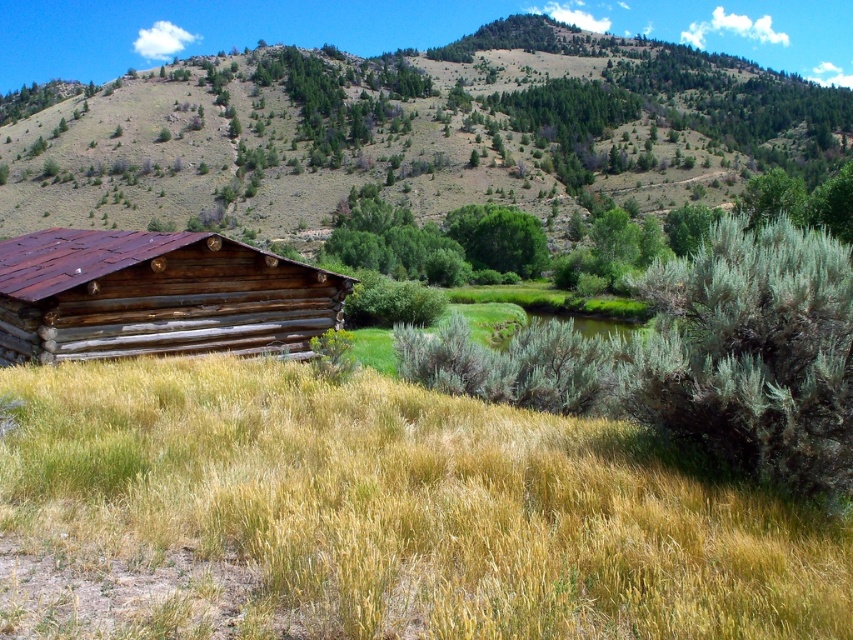
You are a hiker who wants to cross the stream but needs to find the shortest path. You see dry grass at lower left and green grassy hillside at upper center. Which area should you avoid to prevent getting your shoes wet?

You should avoid the green grassy hillside at upper center because it is larger than the dry grass at lower left, so the dry grass at lower left is closer to the stream and might be a safer path.

You are a hiker who needs to cross the area between the dry grass at lower left and the brown wooden log cabin at left. Considering the space each occupies, which area would be easier to traverse quickly?

The brown wooden log cabin at left occupies more space than the dry grass at lower left, so it might be easier to traverse quickly through the dry grass at lower left since it covers a smaller area.

You are planning to build a garden shed on the green grassy hillside at upper center and the brown wooden log cabin at left. Which location has enough space to accommodate a larger shed?

The green grassy hillside at upper center is larger in size than the brown wooden log cabin at left, so the green grassy hillside at upper center has enough space to accommodate a larger shed.